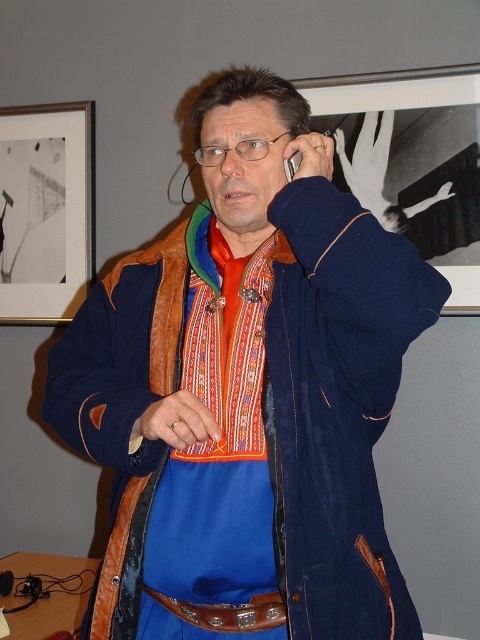
Question: Does embroidered fabric apron at center lie behind matte black frame at upper center?

Choices:
 (A) no
 (B) yes

Answer: (A)

Question: Is matte leather jacket at center above matte black frame at upper left?

Choices:
 (A) no
 (B) yes

Answer: (A)

Question: Which point appears farthest from the camera in this image?

Choices:
 (A) (283, 616)
 (B) (387, 184)
 (C) (39, 184)
 (D) (188, 634)

Answer: (C)

Question: Is matte leather jacket at center below matte black frame at upper center?

Choices:
 (A) yes
 (B) no

Answer: (A)

Question: Which of the following is the closest to the observer?

Choices:
 (A) (350, 76)
 (B) (336, 220)
 (C) (228, 628)

Answer: (B)

Question: Which of the following is the farthest from the observer?

Choices:
 (A) pos(254,236)
 (B) pos(2,257)

Answer: (B)